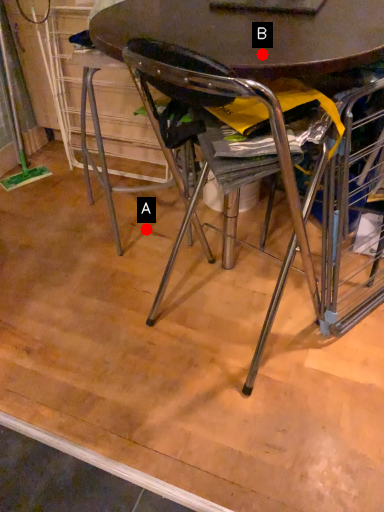
Question: Two points are circled on the image, labeled by A and B beside each circle. Which point is farther to the camera?

Choices:
 (A) A is further
 (B) B is further

Answer: (A)